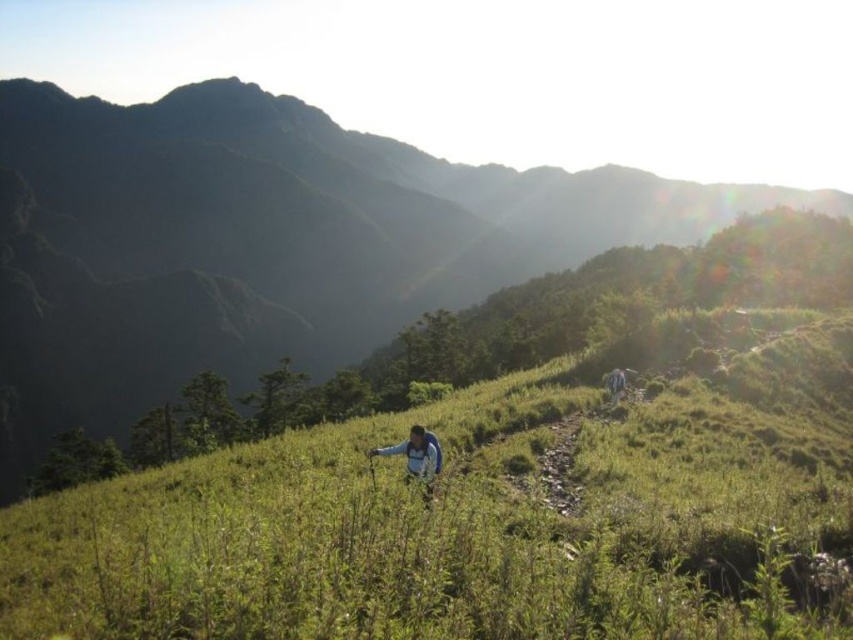
Question: Can you confirm if green grassy at center is positioned to the left of green grassy hillside at center?

Choices:
 (A) no
 (B) yes

Answer: (A)

Question: Among these objects, which one is nearest to the camera?

Choices:
 (A) green grassy at center
 (B) blue fleece jacket at center
 (C) blue fabric jacket at upper right
 (D) green grassy hillside at center

Answer: (A)

Question: Can you confirm if green grassy at center is positioned below blue fabric jacket at upper right?

Choices:
 (A) no
 (B) yes

Answer: (B)

Question: Which point is farther to the camera?

Choices:
 (A) (273, 625)
 (B) (619, 371)
 (C) (425, 497)
 (D) (173, 208)

Answer: (D)

Question: Is green grassy at center smaller than blue fleece jacket at center?

Choices:
 (A) no
 (B) yes

Answer: (A)

Question: Which of the following is the closest to the observer?

Choices:
 (A) blue fabric jacket at upper right
 (B) green grassy at center

Answer: (B)